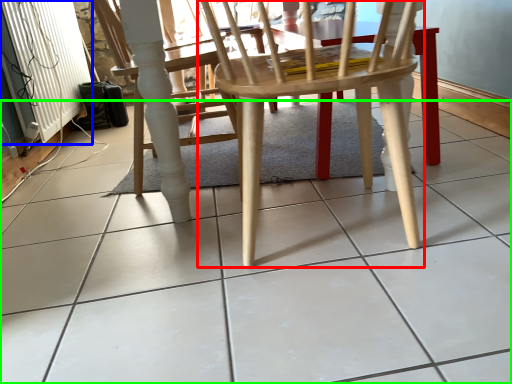
Question: Which object is the closest to the chair (highlighted by a red box)? Choose among these: radiator (highlighted by a blue box) or ceramic tile (highlighted by a green box).

Choices:
 (A) radiator
 (B) ceramic tile

Answer: (B)